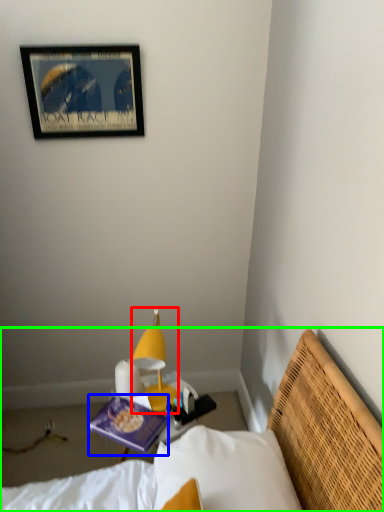
Question: Based on their relative distances, which object is nearer to lamp (highlighted by a red box)? Choose from book (highlighted by a blue box) and bed (highlighted by a green box).

Choices:
 (A) book
 (B) bed

Answer: (A)